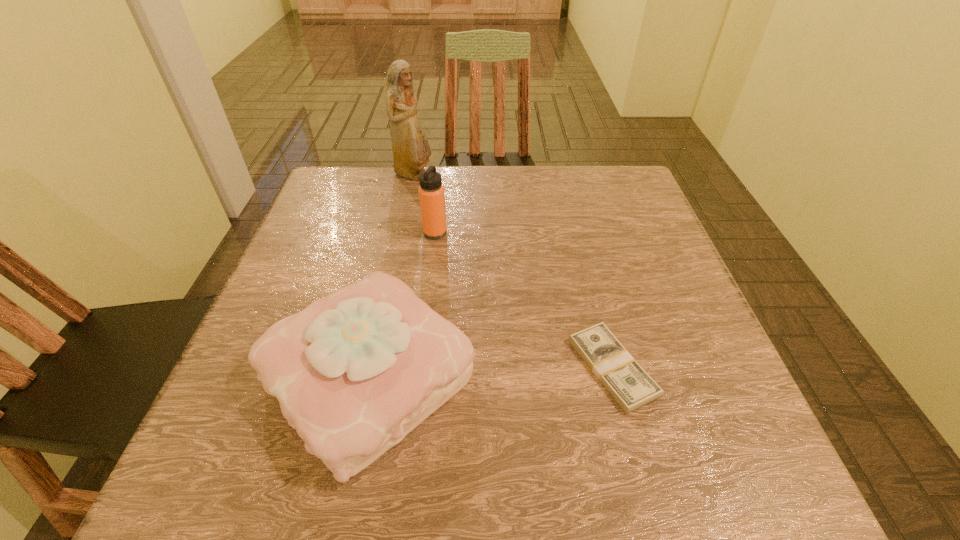
This screenshot has height=540, width=960. Find the location of `vacant space that satisfies the following two spatial constraints: 1. on the front-facing side of the tallest object; 2. on the back side of the third nearest object`. vacant space that satisfies the following two spatial constraints: 1. on the front-facing side of the tallest object; 2. on the back side of the third nearest object is located at coordinates (402, 233).

Where is `vacant space that satisfies the following two spatial constraints: 1. on the back side of the second tallest object; 2. on the front-facing side of the farthest object`? This screenshot has height=540, width=960. vacant space that satisfies the following two spatial constraints: 1. on the back side of the second tallest object; 2. on the front-facing side of the farthest object is located at coordinates (442, 175).

At what (x,y) coordinates should I click in order to perform the action: click on vacant space that satisfies the following two spatial constraints: 1. on the back side of the second shortest object; 2. on the right side of the second tallest object. Please return your answer as a coordinate pair (x, y). This screenshot has width=960, height=540. Looking at the image, I should click on (399, 233).

The height and width of the screenshot is (540, 960). I want to click on vacant region that satisfies the following two spatial constraints: 1. on the front-facing side of the figurine; 2. on the front side of the cake, so click(372, 376).

The height and width of the screenshot is (540, 960). I want to click on free space in the image that satisfies the following two spatial constraints: 1. on the back side of the rightmost object; 2. on the right side of the second shortest object, so click(x=371, y=368).

The width and height of the screenshot is (960, 540). Identify the location of free space that satisfies the following two spatial constraints: 1. on the front-facing side of the figurine; 2. on the right side of the shortest object. (374, 368).

Identify the location of free spot that satisfies the following two spatial constraints: 1. on the front-facing side of the tallest object; 2. on the front side of the second shortest object. This screenshot has width=960, height=540. (372, 376).